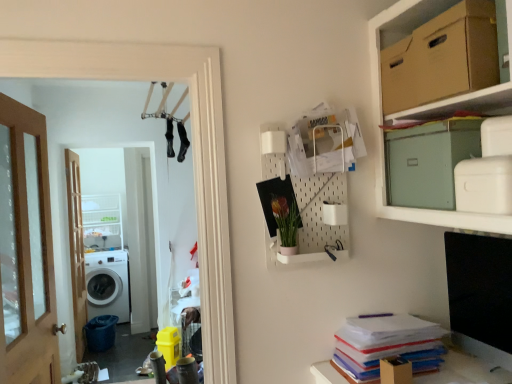
Identify the location of free point above white glossy laundry machine at left (from a real-world perspective). (93, 39).